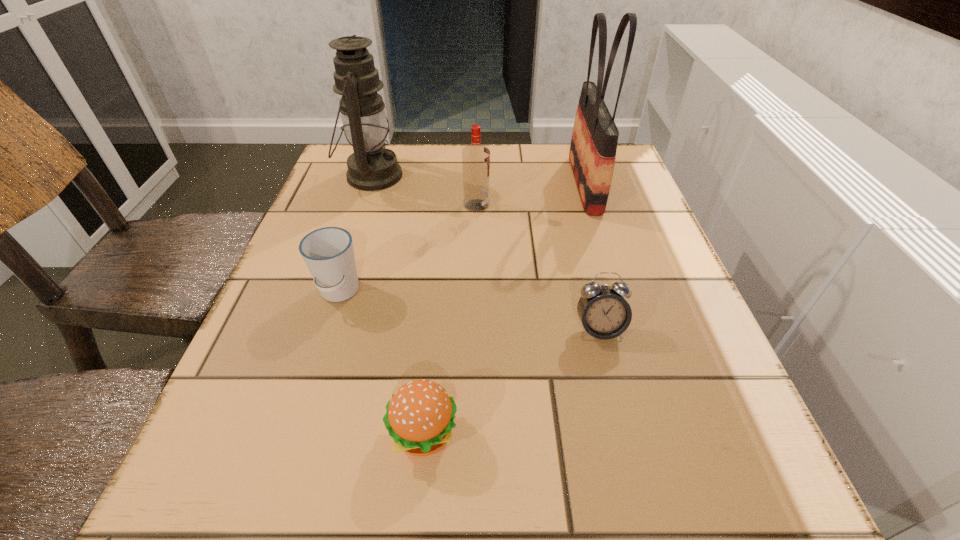
Image resolution: width=960 pixels, height=540 pixels. I want to click on object that stands as the third closest to the shortest object, so click(x=475, y=157).

You are a GUI agent. You are given a task and a screenshot of the screen. Output one action in this format:
    pyautogui.click(x=<x>, y=<y>)
    Task: Click on the vacant space that satisfies the following two spatial constraints: 1. on the front side of the oil lamp; 2. on the right side of the shortest object
    
    Given the screenshot: What is the action you would take?
    pyautogui.click(x=286, y=434)

Identify the location of blank space that satisfies the following two spatial constraints: 1. on the front label of the vodka; 2. with a handle on the side of the fourth farthest object. (475, 293).